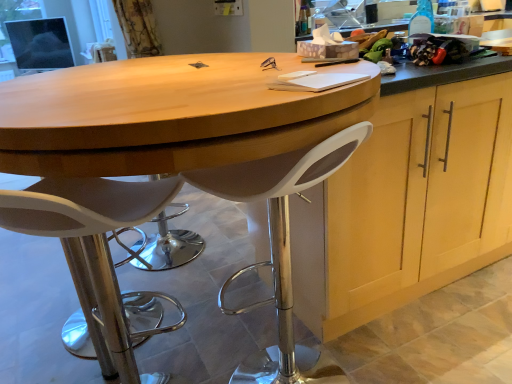
Identify the location of free spot behind white plastic stool at lower left, positioned as the 1th chair in left-to-right order. (168, 347).